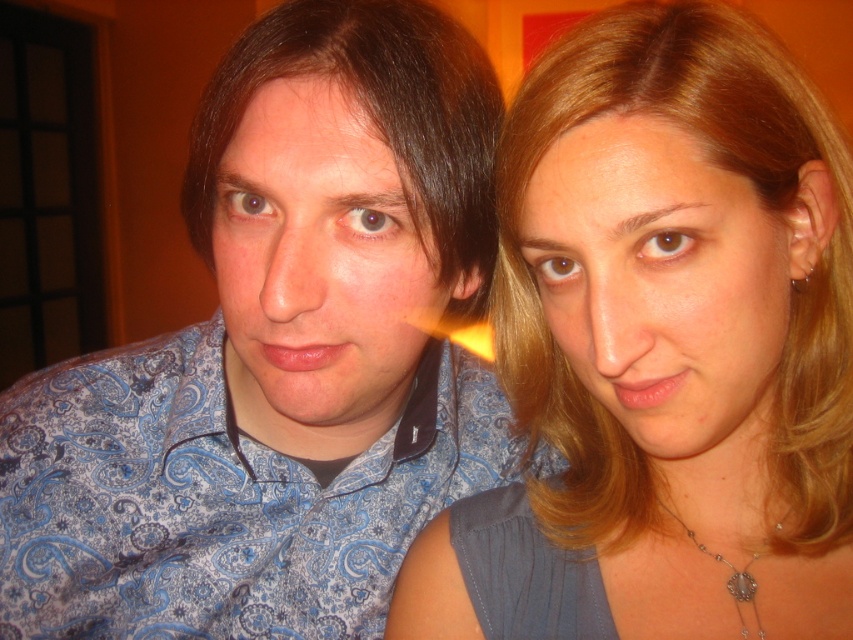
Question: Can you confirm if blue paisley shirt at center is bigger than matte blue shirt at left?

Choices:
 (A) no
 (B) yes

Answer: (B)

Question: Estimate the real-world distances between objects in this image. Which object is closer to the blue paisley shirt at center?

Choices:
 (A) blonde hair at right
 (B) smooth blonde hair at center

Answer: (B)

Question: Which object is positioned closest to the matte blue shirt at left?

Choices:
 (A) smooth blonde hair at center
 (B) blonde hair at right

Answer: (A)

Question: Is the position of blue paisley shirt at center more distant than that of smooth blonde hair at center?

Choices:
 (A) no
 (B) yes

Answer: (B)

Question: Among these points, which one is nearest to the camera?

Choices:
 (A) (717, 531)
 (B) (312, 77)

Answer: (B)

Question: Is blonde hair at right in front of matte blue shirt at left?

Choices:
 (A) no
 (B) yes

Answer: (B)